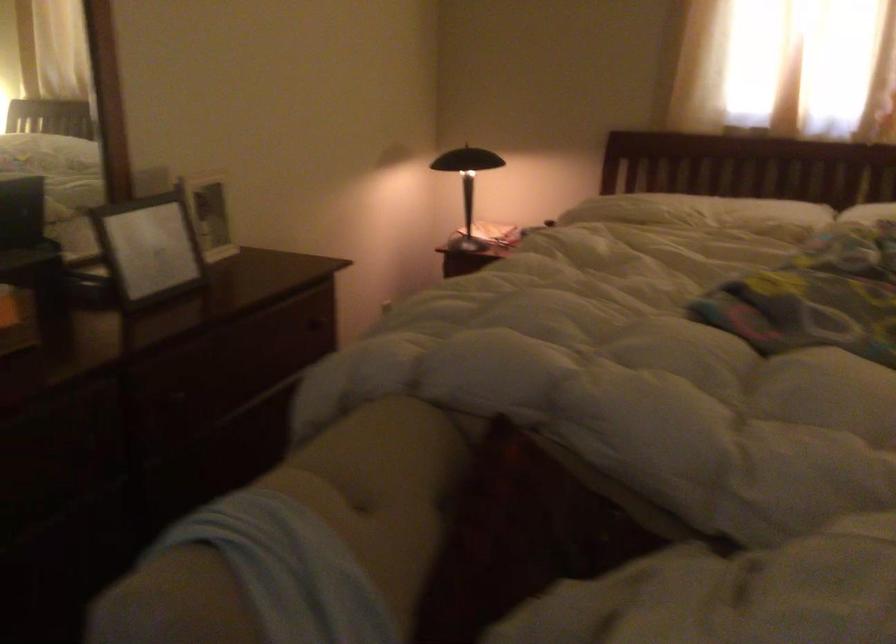
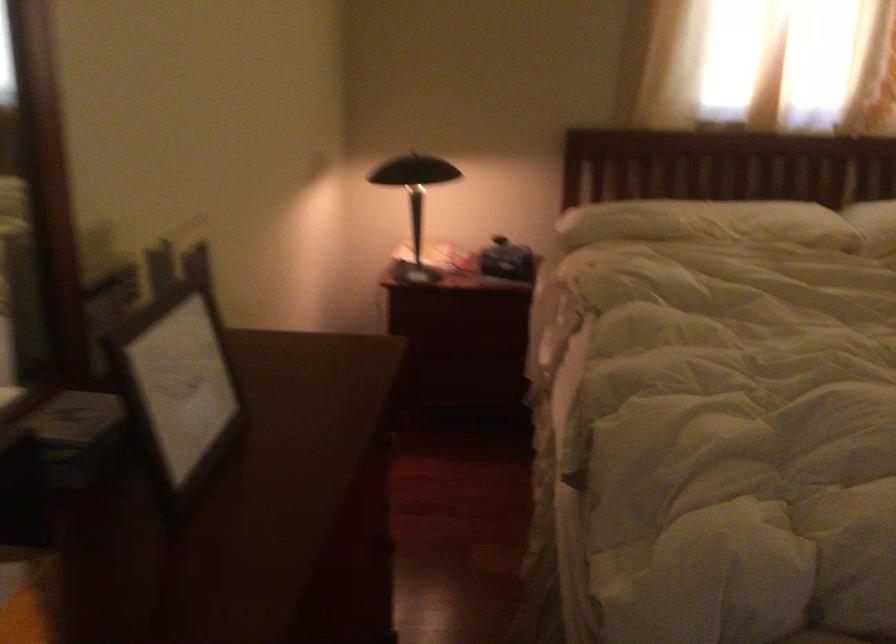
Question: The camera is either moving clockwise (left) or counter-clockwise (right) around the object. The first image is from the beginning of the video and the second image is from the end. Is the camera moving left or right when shooting the video?

Choices:
 (A) Left
 (B) Right

Answer: (A)